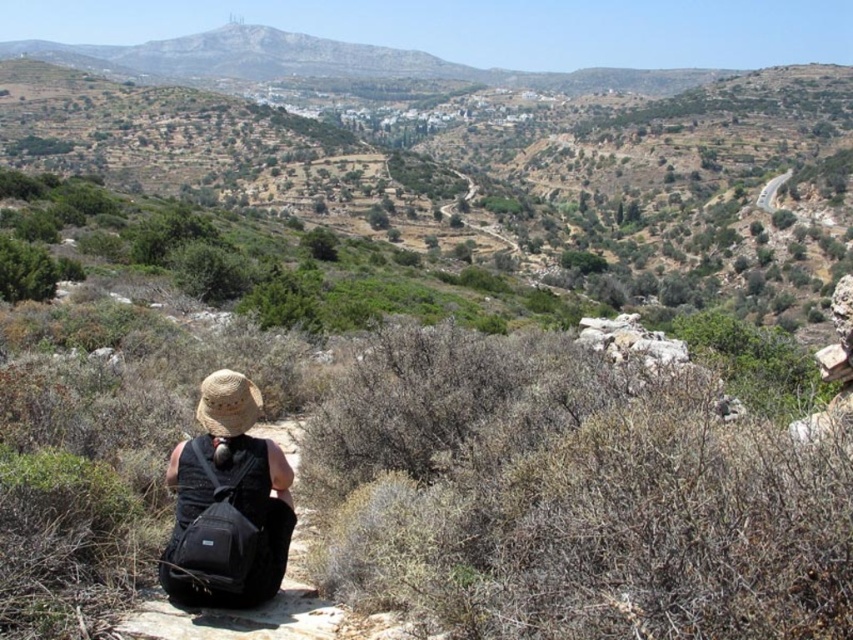
Which is in front, point (227, 548) or point (212, 392)?

Positioned in front is point (227, 548).

Is black fabric backpack at lower left thinner than strawmaterial/texturehat at lower left?

Yes, black fabric backpack at lower left is thinner than strawmaterial/texturehat at lower left.

What do you see at coordinates (227, 502) in the screenshot?
I see `black fabric backpack at lower left` at bounding box center [227, 502].

In order to click on black fabric backpack at lower left in this screenshot , I will do `click(227, 502)`.